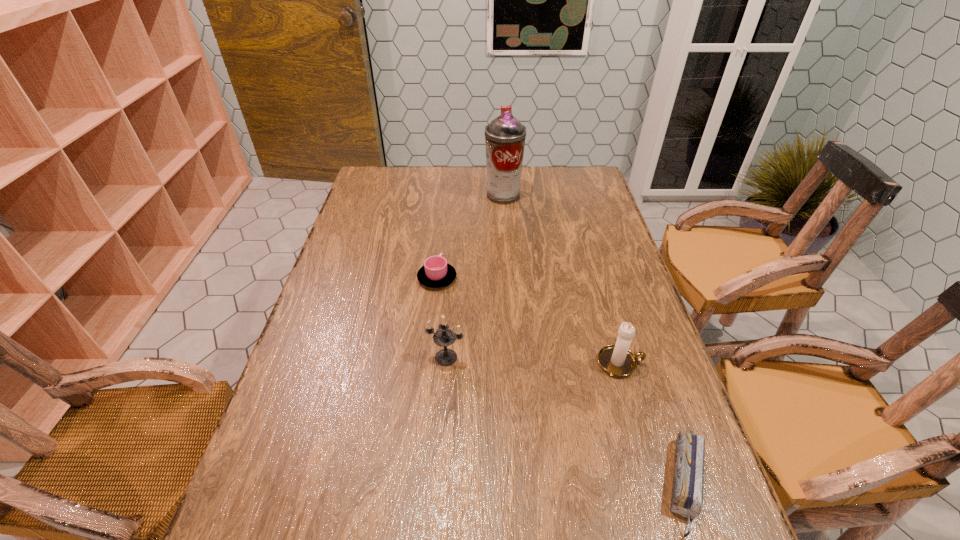
This screenshot has width=960, height=540. Identify the location of empty space between the fourth nearest object and the right candle holder. (529, 320).

You are a GUI agent. You are given a task and a screenshot of the screen. Output one action in this format:
    pyautogui.click(x=<x>, y=<y>)
    Task: Click on the object that can be found as the second closest to the nearest object
    This screenshot has height=540, width=960.
    Given the screenshot: What is the action you would take?
    pyautogui.click(x=443, y=337)

Select which object is the fourth closest to the right candle holder. Please provide its 2D coordinates. Your answer should be formatted as a tuple, i.e. [(x, y)], where the tuple contains the x and y coordinates of a point satisfying the conditions above.

[(505, 136)]

Locate an element on the screen. This screenshot has width=960, height=540. free region that satisfies the following two spatial constraints: 1. on the side with the handle of the farthest object; 2. on the left side of the cup is located at coordinates (445, 195).

The width and height of the screenshot is (960, 540). What are the coordinates of `free space that satisfies the following two spatial constraints: 1. on the side with the handle of the aerosol can; 2. on the right side of the fourth nearest object` in the screenshot? It's located at (445, 195).